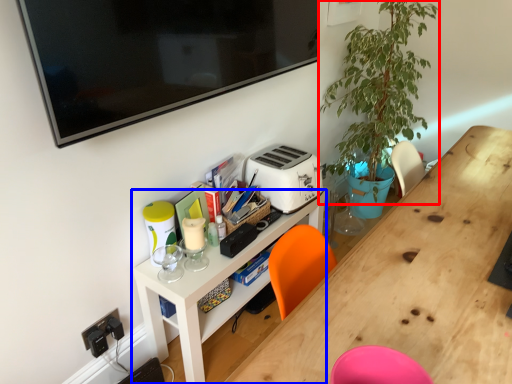
Question: Which of the following is the farthest to the observer, plant (highlighted by a red box) or shelf (highlighted by a blue box)?

Choices:
 (A) plant
 (B) shelf

Answer: (A)